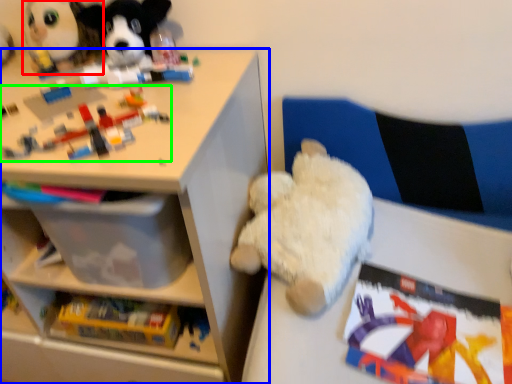
Question: Considering the real-world distances, which object is closest to toy (highlighted by a red box)? shelf (highlighted by a blue box) or toy (highlighted by a green box).

Choices:
 (A) shelf
 (B) toy

Answer: (B)